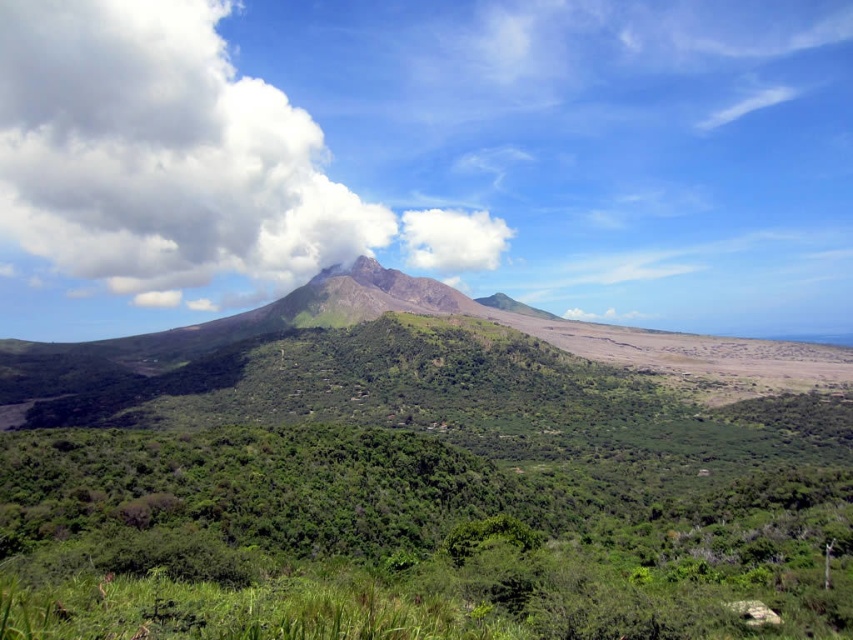
Can you confirm if green leafy vegetation at center is shorter than white fluffy cloud at upper left?

Correct, green leafy vegetation at center is not as tall as white fluffy cloud at upper left.

Can you confirm if green leafy vegetation at center is positioned below white fluffy cloud at upper left?

Yes.

The width and height of the screenshot is (853, 640). What do you see at coordinates (450, 480) in the screenshot?
I see `green leafy vegetation at center` at bounding box center [450, 480].

Where is `green leafy vegetation at center`? The height and width of the screenshot is (640, 853). green leafy vegetation at center is located at coordinates (450, 480).